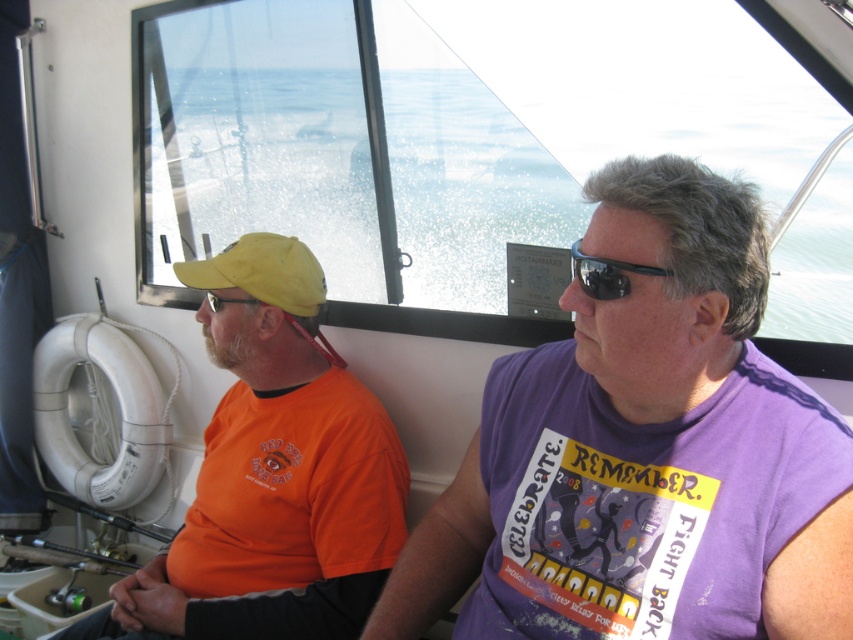
Question: Estimate the real-world distances between objects in this image. Which object is closer to the blue plastic sunglasses at center?

Choices:
 (A) purple cotton shirt at center
 (B) yellow fabric baseball cap at upper left
 (C) orange cotton shirt at left

Answer: (A)

Question: Which point is farther from the camera taking this photo?

Choices:
 (A) (305, 248)
 (B) (583, 252)
 (C) (247, 474)

Answer: (A)

Question: Which object is farther from the camera taking this photo?

Choices:
 (A) yellow fabric baseball cap at upper left
 (B) purple cotton shirt at center
 (C) orange cotton shirt at left
 (D) blue plastic sunglasses at center

Answer: (A)

Question: Can you confirm if purple cotton shirt at center is wider than orange cotton shirt at left?

Choices:
 (A) yes
 (B) no

Answer: (B)

Question: Can you confirm if yellow fabric baseball cap at upper left is positioned above blue plastic sunglasses at center?

Choices:
 (A) yes
 (B) no

Answer: (A)

Question: Is orange cotton shirt at left to the left of blue plastic sunglasses at center from the viewer's perspective?

Choices:
 (A) yes
 (B) no

Answer: (A)